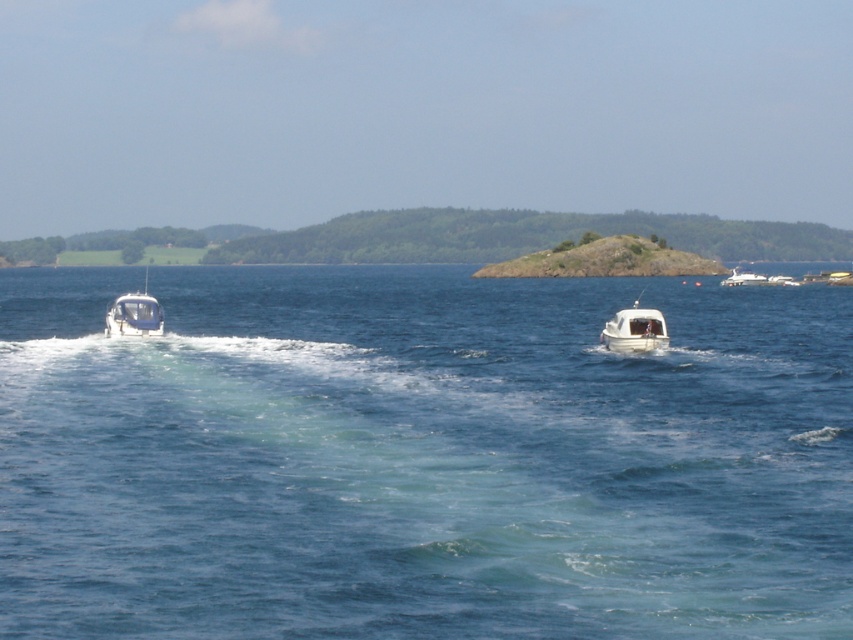
Question: Can you confirm if blue water at center is positioned to the left of white matte boat at center?

Choices:
 (A) yes
 (B) no

Answer: (A)

Question: Which point is closer to the camera?

Choices:
 (A) (653, 316)
 (B) (128, 310)
 (C) (740, 323)
 (D) (741, 276)

Answer: (A)

Question: Is white matte boat at center further to the viewer compared to white glossy boat at right?

Choices:
 (A) no
 (B) yes

Answer: (A)

Question: Which of these objects is positioned closest to the white glossy boat at right?

Choices:
 (A) white glossy boat at left
 (B) white matte boat at center
 (C) blue water at center

Answer: (C)

Question: Based on their relative distances, which object is nearer to the white glossy boat at right?

Choices:
 (A) white matte boat at center
 (B) blue water at center

Answer: (B)

Question: Does blue water at center have a lesser width compared to white glossy boat at right?

Choices:
 (A) yes
 (B) no

Answer: (B)